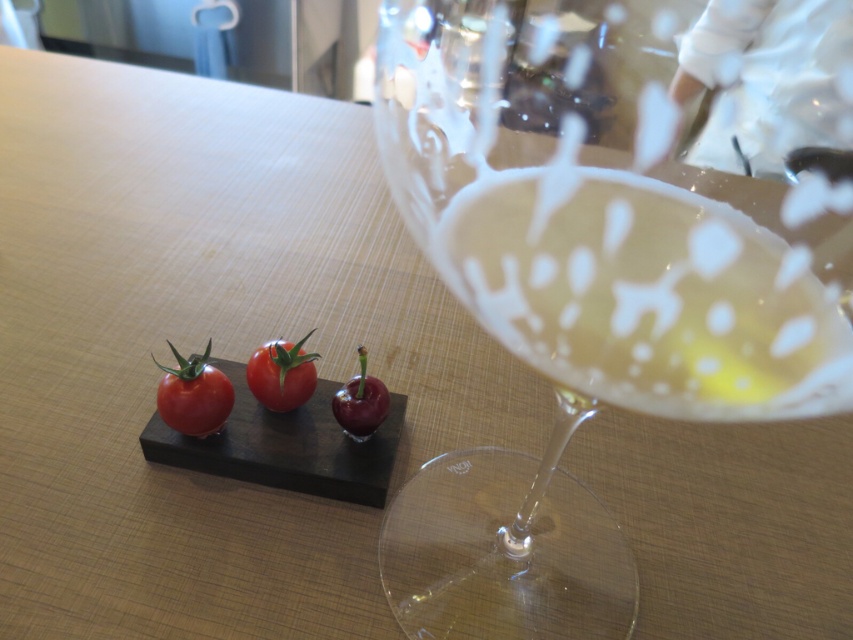
From the picture: Can you confirm if clear glass wine glass at center is taller than shiny red cherry at center?

Correct, clear glass wine glass at center is much taller as shiny red cherry at center.

Can you confirm if clear glass wine glass at center is positioned below shiny red cherry at center?

No.

Which is in front, point (729, 330) or point (363, 376)?

Point (729, 330) is more forward.

At what (x,y) coordinates should I click in order to perform the action: click on clear glass wine glass at center. Please return your answer as a coordinate pair (x, y). This screenshot has height=640, width=853. Looking at the image, I should click on (572, 344).

Which is more to the left, matte red tomato at center or shiny red cherry at center?

matte red tomato at center

What are the coordinates of `matte red tomato at center` in the screenshot? It's located at (193, 396).

Between point (625, 211) and point (160, 401), which one is positioned behind?

Point (160, 401)

Who is more distant from viewer, (x=686, y=337) or (x=198, y=394)?

Positioned behind is point (x=198, y=394).

Locate an element on the screen. translucent glass wine at right is located at coordinates (647, 298).